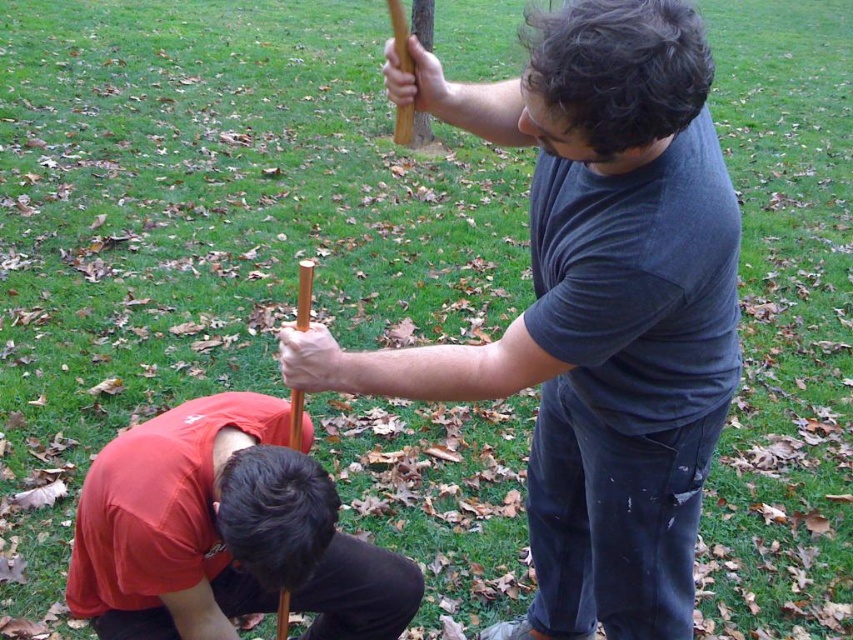
Which is in front, point (604, 522) or point (189, 444)?

Point (189, 444)

Is point (556, 572) positioned before point (142, 547)?

No, it is not.

Where is `matte black shirt at upper right`? matte black shirt at upper right is located at coordinates (595, 308).